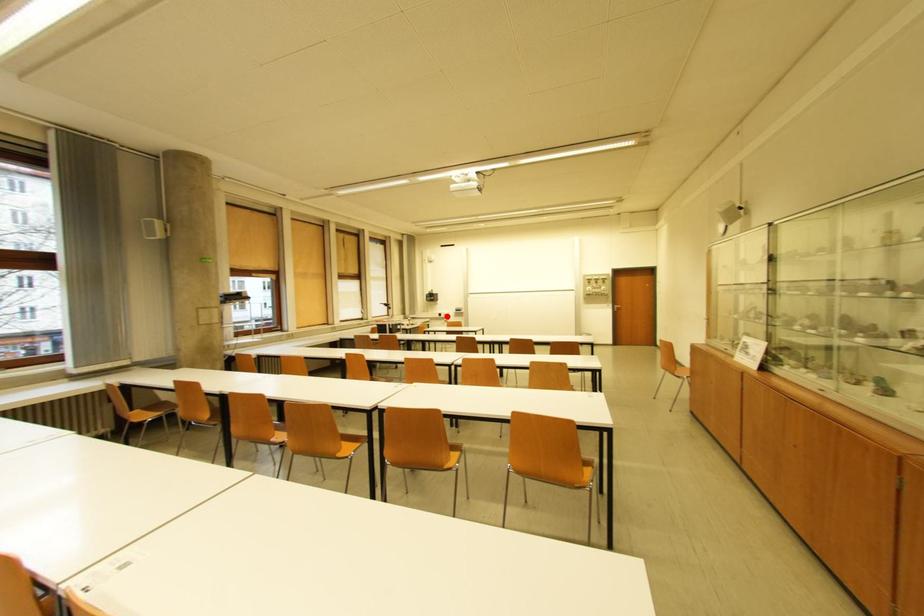
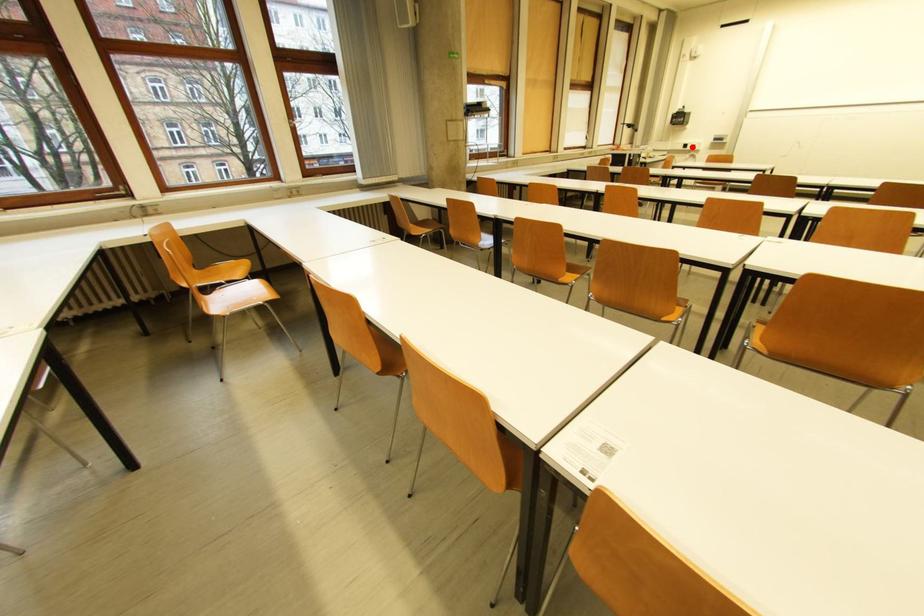
I am providing you with two images of the same scene from different viewpoints. A red point is marked on the first image and another point is marked on the second image. Are the points marked in image1 and image2 representing the same 3D position?

Yes